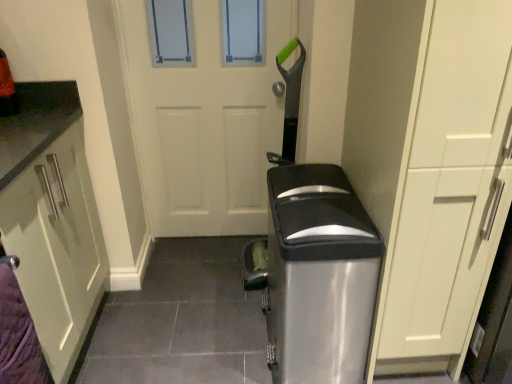
Question: From the image's perspective, relative to matte white cabinet at left, is white matte door at center above or below?

Choices:
 (A) below
 (B) above

Answer: (B)

Question: Do you think white matte door at center is within matte white cabinet at left, or outside of it?

Choices:
 (A) outside
 (B) inside

Answer: (A)

Question: Estimate the real-world distances between objects in this image. Which object is farther from the matte white cabinet at left?

Choices:
 (A) white matte door at center
 (B) matte white cabinet at right
 (C) satin silver trash can at center

Answer: (B)

Question: Which object is the farthest from the white matte door at center?

Choices:
 (A) satin silver trash can at center
 (B) matte white cabinet at right
 (C) matte white cabinet at left

Answer: (B)